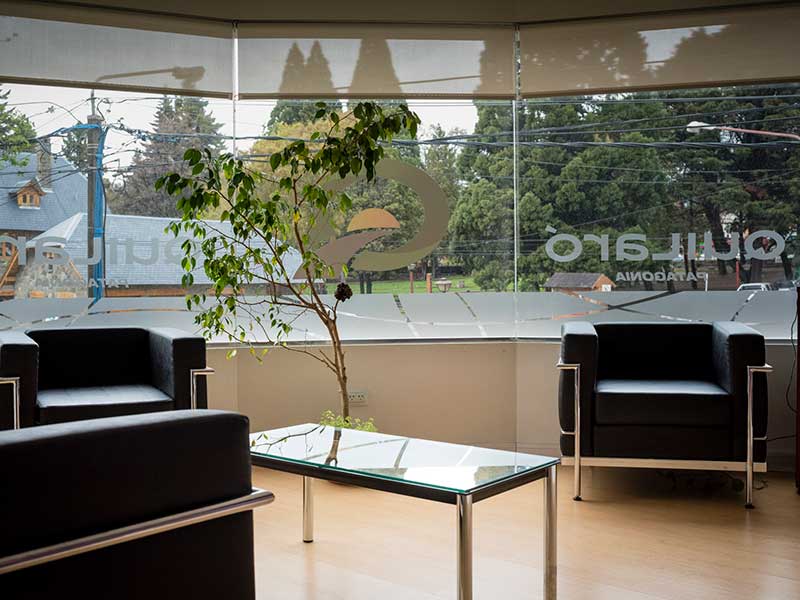
Identify the location of chairs. (88, 375), (645, 349).